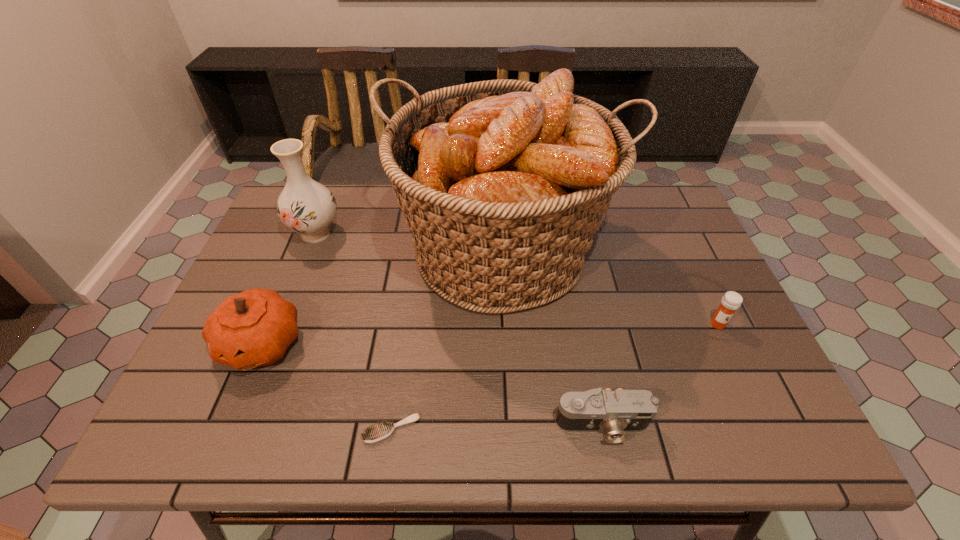
Image resolution: width=960 pixels, height=540 pixels. I want to click on free space between the pumpkin and the camera, so click(x=432, y=384).

The width and height of the screenshot is (960, 540). I want to click on free spot between the camera and the pumpkin, so click(432, 384).

The image size is (960, 540). In order to click on free spot between the tallest object and the fifth shortest object in this screenshot , I will do `click(409, 242)`.

At what (x,y) coordinates should I click in order to perform the action: click on object that is the fifth closest to the fourth shortest object. Please return your answer as a coordinate pair (x, y). The height and width of the screenshot is (540, 960). Looking at the image, I should click on (731, 301).

Select which object is the fifth closest to the shortest object. Please provide its 2D coordinates. Your answer should be formatted as a tuple, i.e. [(x, y)], where the tuple contains the x and y coordinates of a point satisfying the conditions above.

[(731, 301)]